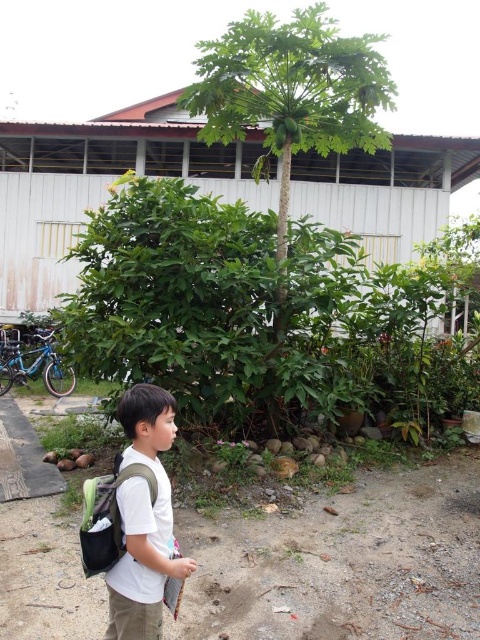
Question: Which point is farther to the camera?

Choices:
 (A) (155, 426)
 (B) (85, 554)

Answer: (A)

Question: Which object is farther from the camera taking this photo?

Choices:
 (A) white matte shirt at lower left
 (B) matte black backpack at lower left

Answer: (B)

Question: Is white matte shirt at lower left behind matte black backpack at lower left?

Choices:
 (A) yes
 (B) no

Answer: (B)

Question: Does white matte shirt at lower left have a smaller size compared to matte black backpack at lower left?

Choices:
 (A) yes
 (B) no

Answer: (B)

Question: Can you confirm if white matte shirt at lower left is positioned below matte black backpack at lower left?

Choices:
 (A) no
 (B) yes

Answer: (B)